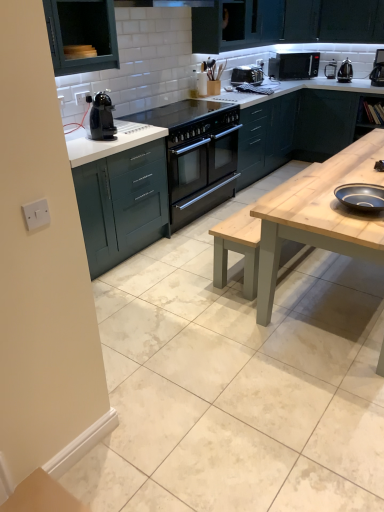
Image resolution: width=384 pixels, height=512 pixels. What are the coordinates of `vacant point to the left of natural wood table at center` in the screenshot? It's located at (187, 323).